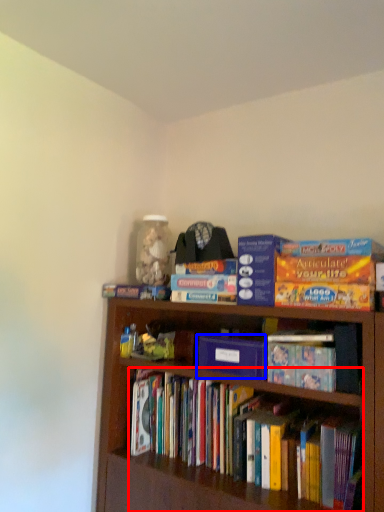
Question: Which object appears farthest to the camera in this image, book (highlighted by a red box) or paperback book (highlighted by a blue box)?

Choices:
 (A) book
 (B) paperback book

Answer: (B)